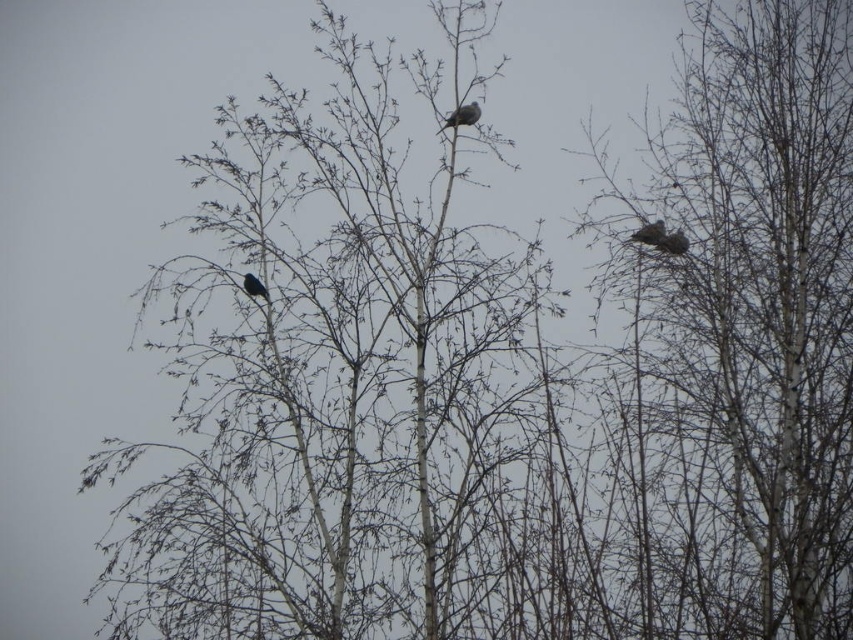
Question: Which point is closer to the camera taking this photo?

Choices:
 (A) (762, 224)
 (B) (467, 115)

Answer: (B)

Question: Is brown fuzzy nest at upper right bigger than gray matte bird at upper center?

Choices:
 (A) no
 (B) yes

Answer: (A)

Question: Does bare branches at upper center lie in front of dark blue feathers at center?

Choices:
 (A) yes
 (B) no

Answer: (A)

Question: Can you confirm if brown speckled feather at right is positioned above dark blue feathers at center?

Choices:
 (A) no
 (B) yes

Answer: (B)

Question: Which object is the farthest from the brown fuzzy nest at upper right?

Choices:
 (A) brown speckled feather at right
 (B) dark blue feathers at center

Answer: (B)

Question: Which of the following is the closest to the observer?

Choices:
 (A) dark blue feathers at center
 (B) brown fuzzy nest at upper right
 (C) brown speckled feather at right

Answer: (A)